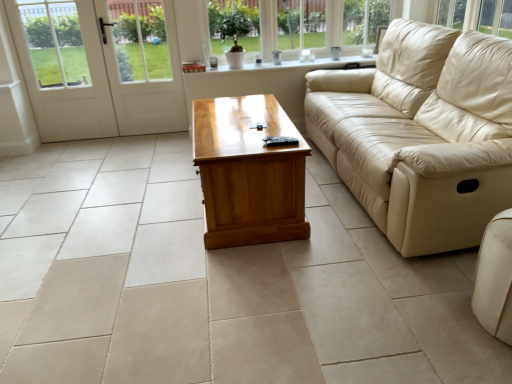
What are the coordinates of `free spot in front of light brown wood coffee table at center` in the screenshot? It's located at (263, 289).